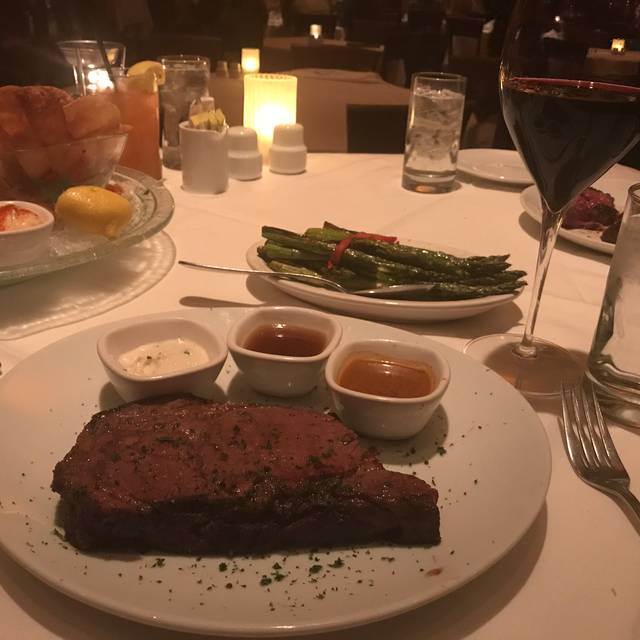
Locate an element on the screen. Image resolution: width=640 pixels, height=640 pixels. glass of red wine is located at coordinates (577, 140).